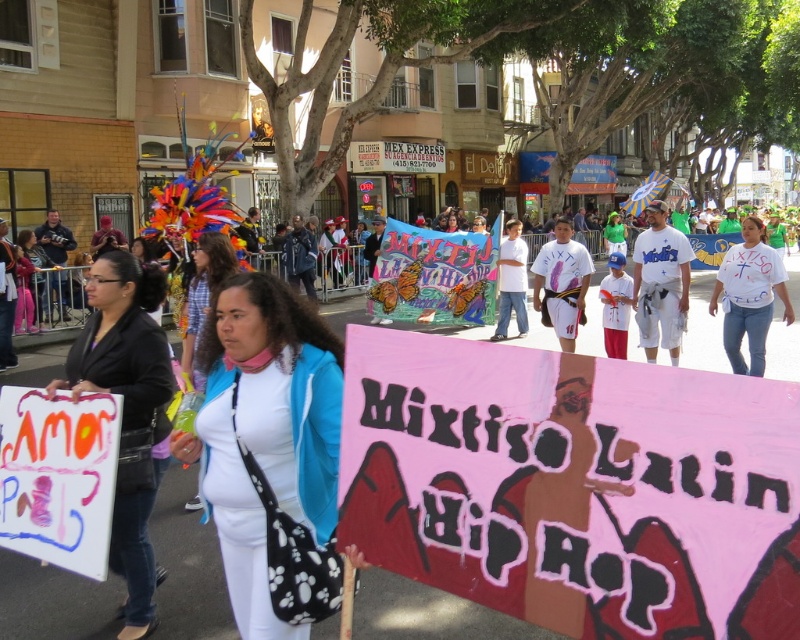
Question: Considering the relative positions of white matte jacket at center and white t-shirt at center in the image provided, where is white matte jacket at center located with respect to white t-shirt at center?

Choices:
 (A) right
 (B) left

Answer: (B)

Question: Is matte black jacket at center smaller than white t-shirt at center?

Choices:
 (A) yes
 (B) no

Answer: (A)

Question: Which of the following is the closest to the observer?

Choices:
 (A) white t-shirt at center
 (B) white fabric at center

Answer: (B)

Question: Which of the following is the closest to the observer?

Choices:
 (A) white fabric at center
 (B) white matte jacket at center
 (C) pink paper sign at center

Answer: (C)

Question: Can you confirm if matte black jacket at center is wider than white t-shirt at center?

Choices:
 (A) yes
 (B) no

Answer: (B)

Question: Which object is farther from the camera taking this photo?

Choices:
 (A) matte black jacket at center
 (B) white matte jacket at center
 (C) white fabric at center

Answer: (C)